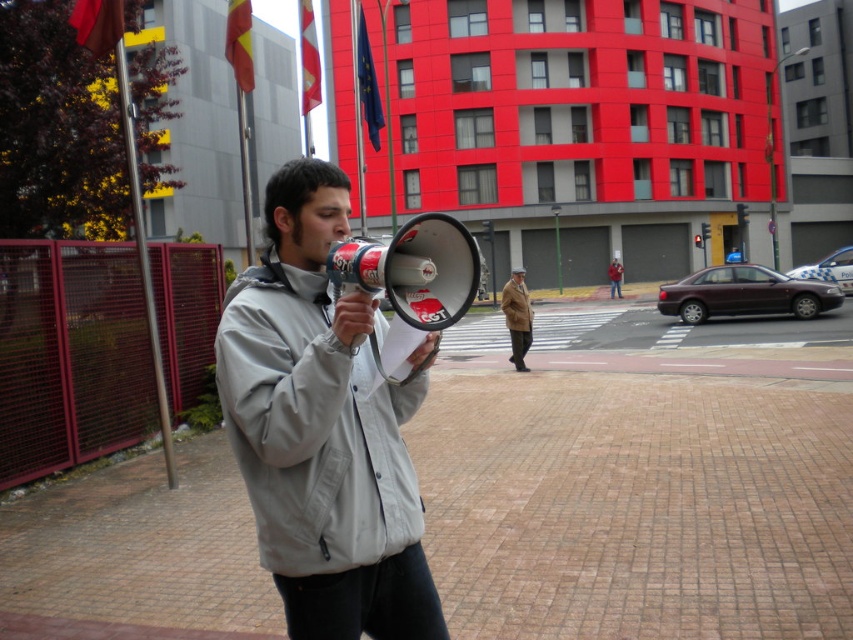
Based on the photo, is light gray fabric jacket at center behind brown wool coat at center?

No, it is in front of brown wool coat at center.

Does point (300, 563) come behind point (519, 307)?

That is False.

The width and height of the screenshot is (853, 640). What do you see at coordinates (322, 429) in the screenshot?
I see `light gray fabric jacket at center` at bounding box center [322, 429].

In order to click on light gray fabric jacket at center in this screenshot , I will do `click(322, 429)`.